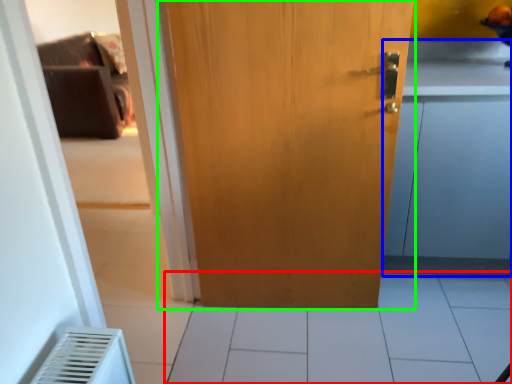
Question: Considering the real-world distances, which object is closest to tile (highlighted by a red box)? cabinetry (highlighted by a blue box) or door (highlighted by a green box).

Choices:
 (A) cabinetry
 (B) door

Answer: (A)